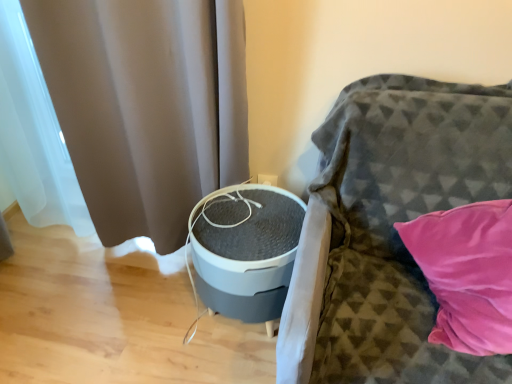
What do you see at coordinates (146, 106) in the screenshot? The width and height of the screenshot is (512, 384). I see `matte gray curtain at left` at bounding box center [146, 106].

In order to click on matte gray curtain at left in this screenshot , I will do `click(146, 106)`.

In order to face matte gray curtain at left, should I rotate leftwards or rightwards?

Rotate left and turn 18.699 degrees.

Measure the distance between point (160,145) and camera.

They are 1.49 meters apart.

Identify the location of textured gray sofa at right. (389, 229).

Image resolution: width=512 pixels, height=384 pixels. Describe the element at coordinates (389, 229) in the screenshot. I see `textured gray sofa at right` at that location.

Identify the location of matte gray curtain at left. This screenshot has width=512, height=384. (146, 106).

Considering the relative positions of textured gray sofa at right and matte gray curtain at left in the image provided, is textured gray sofa at right to the left of matte gray curtain at left from the viewer's perspective?

No.

Is textured gray sofa at right further to camera compared to matte gray curtain at left?

No, the depth of textured gray sofa at right is less than that of matte gray curtain at left.

Is point (388, 137) positioned behind point (214, 158)?

No, it is not.

From the image's perspective, which one is positioned higher, textured gray sofa at right or matte gray curtain at left?

matte gray curtain at left, from the image's perspective.

From a real-world perspective, which object stands above the other?

matte gray curtain at left is physically above.

Is textured gray sofa at right thinner than matte gray curtain at left?

In fact, textured gray sofa at right might be wider than matte gray curtain at left.

Looking at this image, is textured gray sofa at right shorter than matte gray curtain at left?

Indeed, textured gray sofa at right has a lesser height compared to matte gray curtain at left.

Does textured gray sofa at right have a larger size compared to matte gray curtain at left?

Yes, textured gray sofa at right is bigger than matte gray curtain at left.

Is textured gray sofa at right not inside matte gray curtain at left?

Yes, textured gray sofa at right is outside of matte gray curtain at left.

Would you consider textured gray sofa at right to be distant from matte gray curtain at left?

textured gray sofa at right is near matte gray curtain at left, not far away.

Is textured gray sofa at right positioned with its back to matte gray curtain at left?

That's not correct — textured gray sofa at right is not looking away from matte gray curtain at left.

How different are the orientations of textured gray sofa at right and matte gray curtain at left in degrees?

There is a 0.666-degree angle between the facing directions of textured gray sofa at right and matte gray curtain at left.

Measure the distance from textured gray sofa at right to matte gray curtain at left.

textured gray sofa at right is 24.45 inches away from matte gray curtain at left.

Where is `furniture lying in front of the matte gray curtain at left`? Image resolution: width=512 pixels, height=384 pixels. furniture lying in front of the matte gray curtain at left is located at coordinates (389, 229).

Between matte gray curtain at left and textured gray sofa at right, which one appears on the left side from the viewer's perspective?

matte gray curtain at left is more to the left.

Considering the positions of objects matte gray curtain at left and textured gray sofa at right in the image provided, who is in front, matte gray curtain at left or textured gray sofa at right?

textured gray sofa at right is more forward.

Considering the points (214, 19) and (298, 259), which point is behind, point (214, 19) or point (298, 259)?

The point (214, 19) is farther.

From the image's perspective, is matte gray curtain at left positioned above or below textured gray sofa at right?

matte gray curtain at left is situated higher than textured gray sofa at right in the image.

From a real-world perspective, is matte gray curtain at left beneath textured gray sofa at right?

No.

Looking at their sizes, would you say matte gray curtain at left is wider or thinner than textured gray sofa at right?

Considering their sizes, matte gray curtain at left looks slimmer than textured gray sofa at right.

Between matte gray curtain at left and textured gray sofa at right, which one has less height?

Standing shorter between the two is textured gray sofa at right.

Who is bigger, matte gray curtain at left or textured gray sofa at right?

textured gray sofa at right is bigger.

Is matte gray curtain at left surrounding textured gray sofa at right?

Actually, textured gray sofa at right is outside matte gray curtain at left.

In the scene shown: Is matte gray curtain at left in contact with textured gray sofa at right?

No, matte gray curtain at left is not with textured gray sofa at right.

Is matte gray curtain at left turned away from textured gray sofa at right?

No, textured gray sofa at right is not at the back of matte gray curtain at left.

Identify the location of curtain that appears above the textured gray sofa at right (from a real-world perspective). (146, 106).

Locate an element on the screen. furniture below the matte gray curtain at left (from the image's perspective) is located at coordinates (389, 229).

In order to click on furniture on the right side of matte gray curtain at left in this screenshot , I will do `click(389, 229)`.